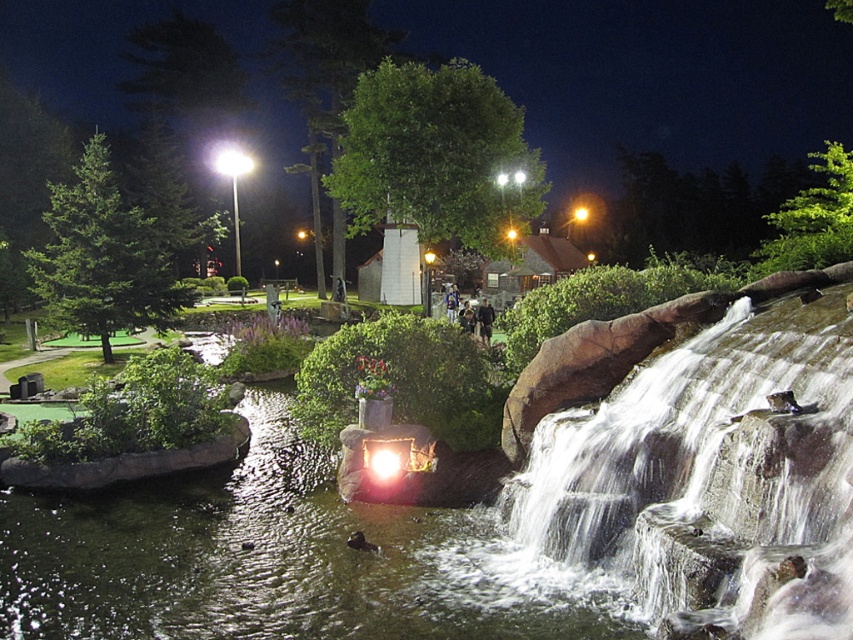
You are standing at the edge of the pool and want to step onto the path behind the black fabric person at center. Considering the size of the translucent glass water at center, do you think there is enough space to walk around them?

The translucent glass water at center has a smaller size compared to the black fabric person at center, so there should be enough space to walk around them as the water area is not as large as the person.

You are standing at the edge of the clear water at center. If you walk straight ahead, will you reach the building in the background before the path ends?

The clear water at center is located at point [699,483], which is closer to the building in the background than the path ends. Therefore, walking straight ahead from the clear water at center will lead you to the building before the path ends.

You are standing on the pathway in the park and see the clear water at center and the black fabric person at center. Which one is wider?

The clear water at center is wider than the black fabric person at center.